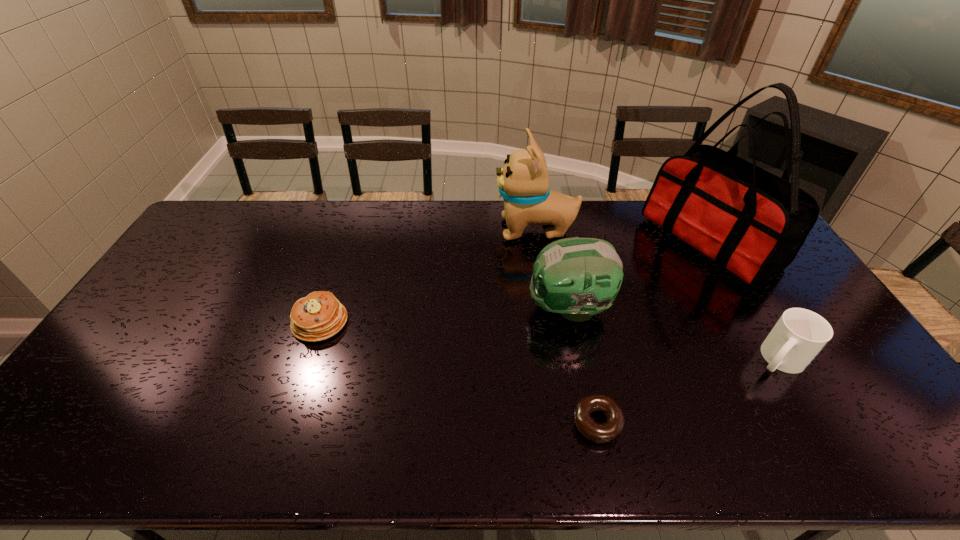
The image size is (960, 540). I want to click on the tallest object, so click(x=752, y=223).

Where is `puppy`? The width and height of the screenshot is (960, 540). puppy is located at coordinates (523, 182).

Locate an element on the screen. The width and height of the screenshot is (960, 540). football helmet is located at coordinates [x=577, y=277].

At what (x,y) coordinates should I click in order to perform the action: click on the third shortest object. Please return your answer as a coordinate pair (x, y). The width and height of the screenshot is (960, 540). Looking at the image, I should click on (799, 335).

Identify the location of pancake. This screenshot has height=540, width=960. (318, 316).

This screenshot has width=960, height=540. Identify the location of the fifth tallest object. (318, 316).

At what (x,y) coordinates should I click in order to perform the action: click on the nearest object. Please return your answer as a coordinate pair (x, y). The height and width of the screenshot is (540, 960). Looking at the image, I should click on (601, 433).

I want to click on the shortest object, so click(601, 433).

The height and width of the screenshot is (540, 960). Find the location of `free spot located 0.050m on the front of the tallest object`. free spot located 0.050m on the front of the tallest object is located at coordinates (745, 305).

Locate an element on the screen. This screenshot has height=540, width=960. free space located on the face of the puppy is located at coordinates (388, 230).